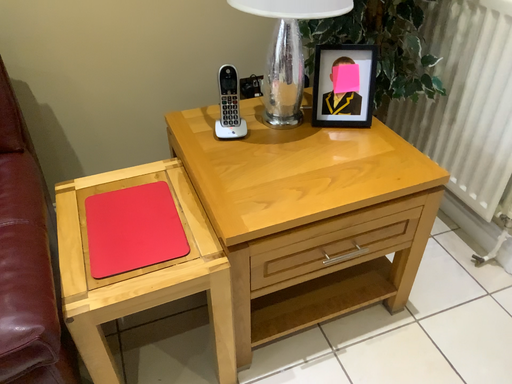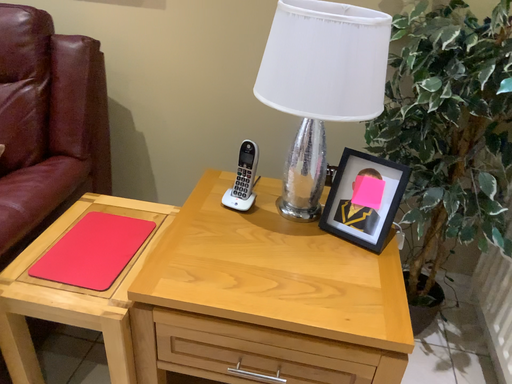
Question: Which way did the camera rotate in the video?

Choices:
 (A) rotated right
 (B) rotated left

Answer: (B)